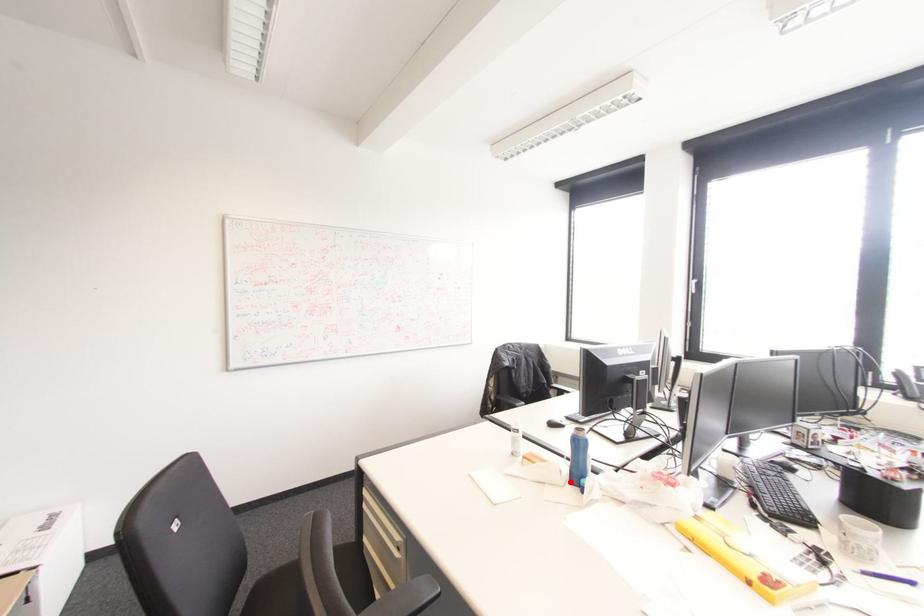
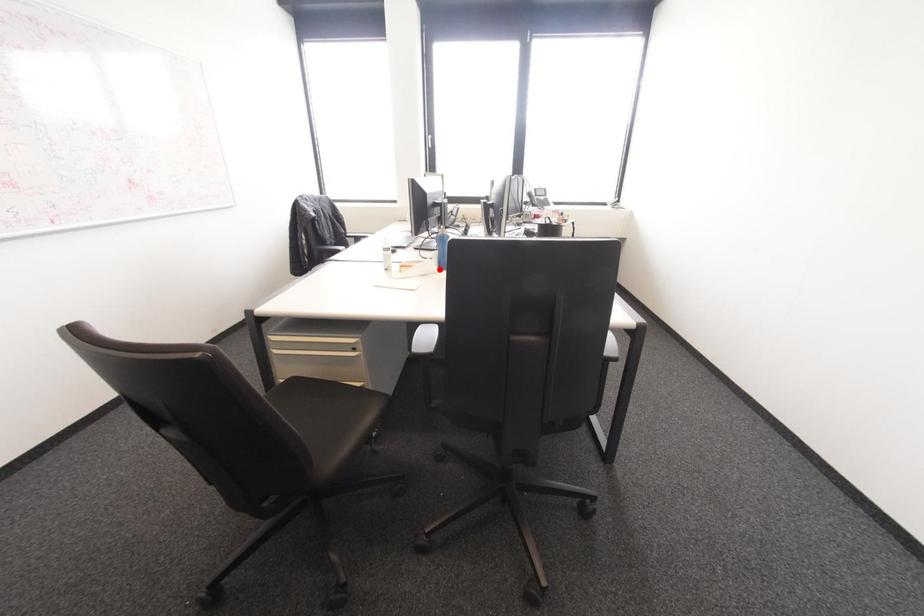
I am providing you with two images of the same scene from different viewpoints. A red point is marked on the first image and another point is marked on the second image. Is the red point in image1 aligned with the point shown in image2?

Yes